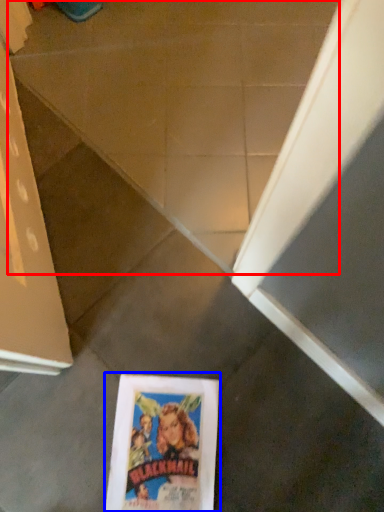
Question: Which of the following is the closest to the observer, concrete (highlighted by a red box) or paperback book (highlighted by a blue box)?

Choices:
 (A) concrete
 (B) paperback book

Answer: (B)